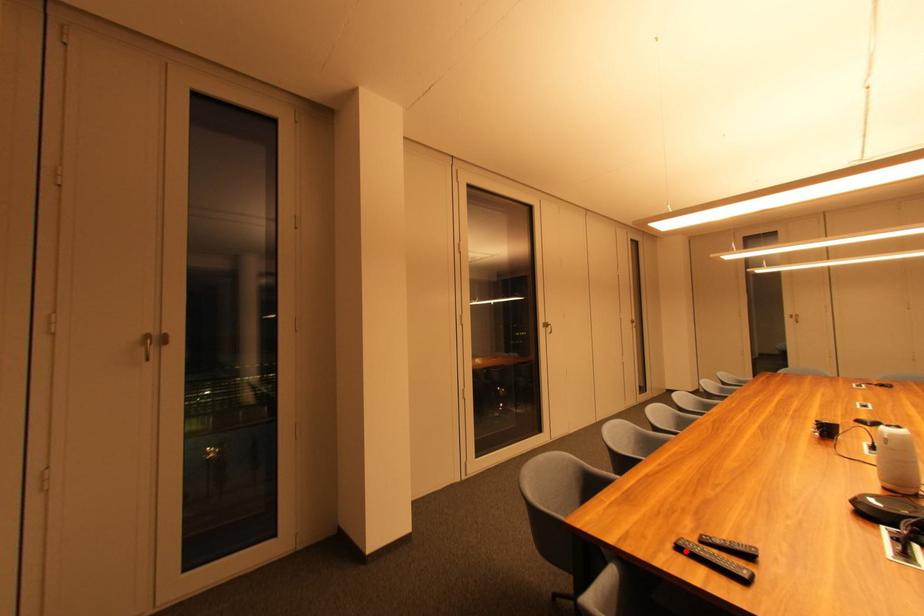
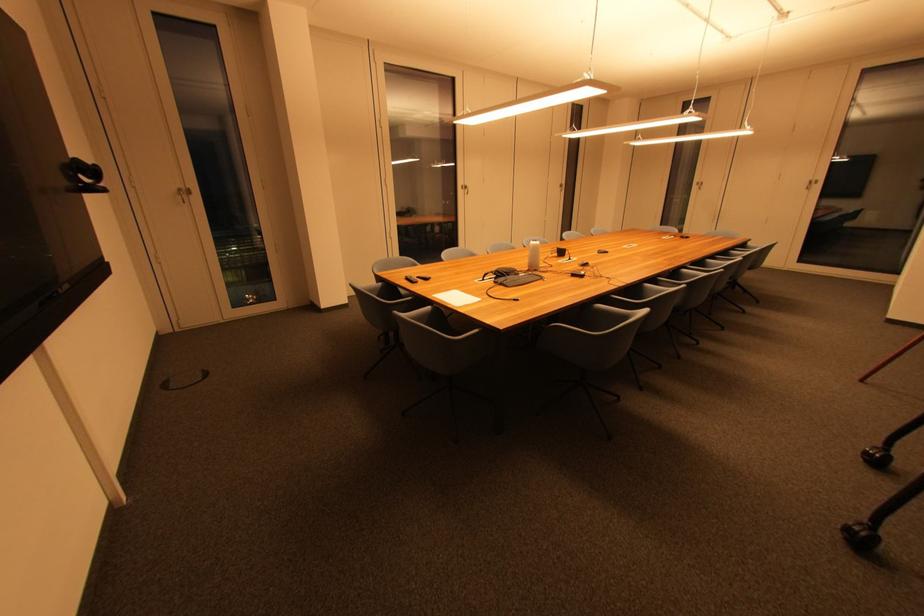
Where in the second image is the point corresponding to the highlighted location from the first image?

(411, 281)